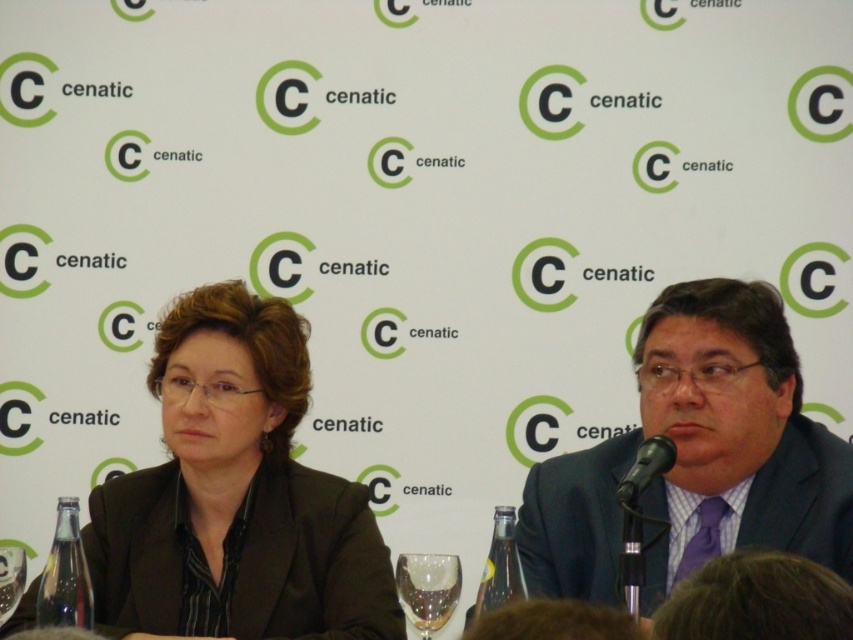
Question: Which point appears farthest from the camera in this image?

Choices:
 (A) (550, 484)
 (B) (189, 529)
 (C) (405, 609)

Answer: (A)

Question: Where is matte black suit at center located in relation to transparent glass at center in the image?

Choices:
 (A) left
 (B) right

Answer: (B)

Question: Estimate the real-world distances between objects in this image. Which object is closer to the transparent glass at center?

Choices:
 (A) matte black suit at center
 (B) black plastic microphone at lower right

Answer: (B)

Question: Does matte black blazer at center lie behind transparent glass at center?

Choices:
 (A) no
 (B) yes

Answer: (B)

Question: Which is nearer to the transparent glass at center?

Choices:
 (A) matte black suit at center
 (B) black plastic microphone at lower right
 (C) matte black blazer at center

Answer: (B)

Question: Is the position of matte black suit at center less distant than that of black plastic microphone at lower right?

Choices:
 (A) no
 (B) yes

Answer: (B)